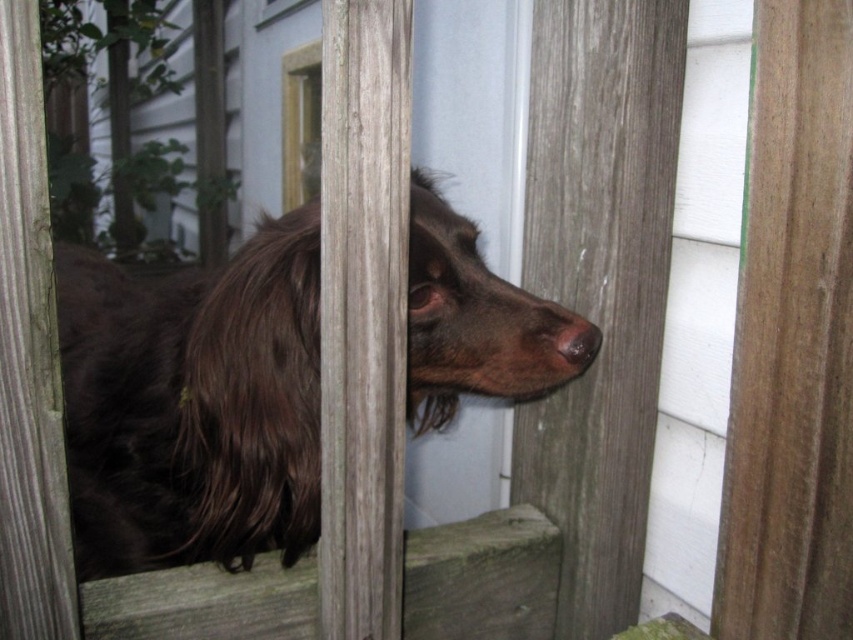
Question: Is shiny brown fur at center to the left of brown matte nose at center from the viewer's perspective?

Choices:
 (A) yes
 (B) no

Answer: (A)

Question: Is shiny brown fur at center wider than brown matte nose at center?

Choices:
 (A) no
 (B) yes

Answer: (B)

Question: Can you confirm if shiny brown fur at center is bigger than brown matte nose at center?

Choices:
 (A) yes
 (B) no

Answer: (A)

Question: Which point is farther from the camera taking this photo?

Choices:
 (A) (576, 328)
 (B) (300, 440)

Answer: (A)